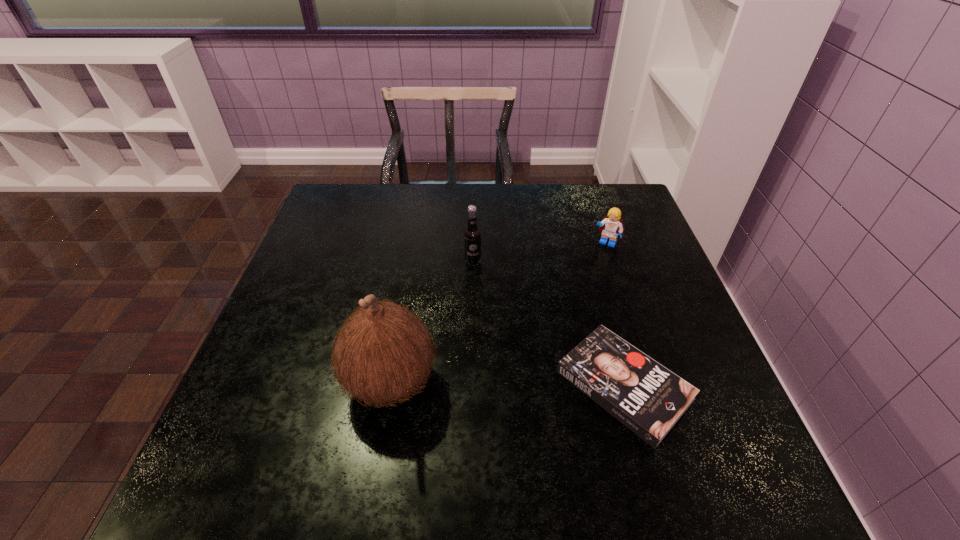
Image resolution: width=960 pixels, height=540 pixels. Identify the location of free spot between the root beer and the leftmost object. coord(432,321).

Where is `vacant space that is in between the third object from right to left and the book`? Image resolution: width=960 pixels, height=540 pixels. vacant space that is in between the third object from right to left and the book is located at coordinates (548, 323).

Find the location of a particular element. free space between the book and the third shortest object is located at coordinates (548, 323).

What are the coordinates of `empty location between the root beer and the book` in the screenshot? It's located at (548, 323).

This screenshot has height=540, width=960. I want to click on vacant area that lies between the leftmost object and the shortest object, so click(507, 383).

Where is `free point between the book and the second shortest object`? This screenshot has width=960, height=540. free point between the book and the second shortest object is located at coordinates (614, 314).

Identify the location of free spot between the third tallest object and the tallest object. This screenshot has width=960, height=540. (498, 312).

Where is `vacant region between the Lego and the third object from right to left`? vacant region between the Lego and the third object from right to left is located at coordinates (540, 252).

Locate which object ranks third in proximity to the third shortest object. Please provide its 2D coordinates. Your answer should be formatted as a tuple, i.e. [(x, y)], where the tuple contains the x and y coordinates of a point satisfying the conditions above.

[(611, 226)]

At what (x,y) coordinates should I click in order to perform the action: click on object identified as the second closest to the shortest object. Please return your answer as a coordinate pair (x, y). This screenshot has height=540, width=960. Looking at the image, I should click on point(472,236).